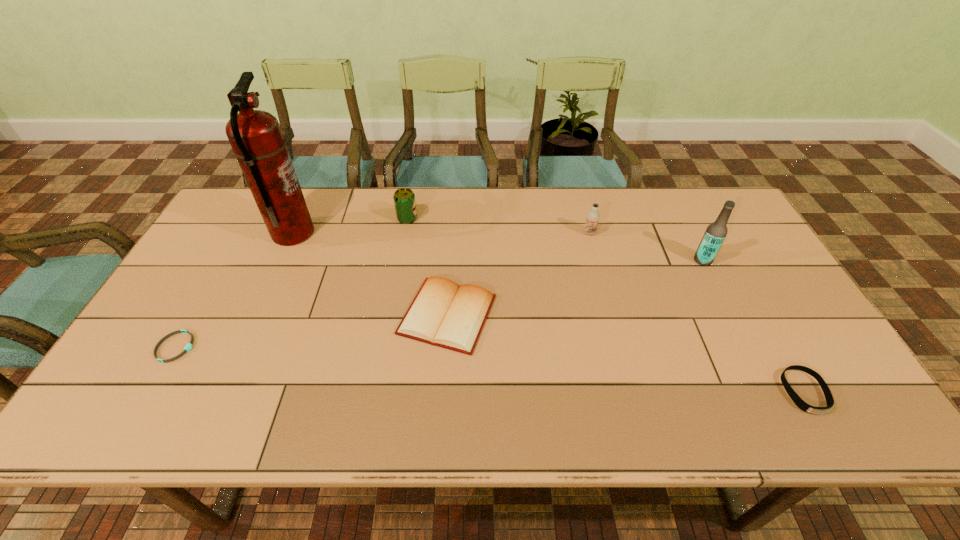
This screenshot has height=540, width=960. I want to click on the farther wristband, so click(x=188, y=347).

You are a GUI agent. You are given a task and a screenshot of the screen. Output one action in this format:
    pyautogui.click(x=<x>, y=<y>)
    Task: Click on the free space located on the side of the tallest object with the handle and hose
    This screenshot has width=960, height=540.
    Given the screenshot: What is the action you would take?
    pyautogui.click(x=372, y=233)

Identify the location of vacant area located 0.280m on the label of the second tallest object. The image size is (960, 540). (599, 260).

In order to click on vacant space located 0.330m on the label of the second tallest object in this screenshot , I will do `click(582, 260)`.

Where is `vacant region located on the label of the second tallest object`? vacant region located on the label of the second tallest object is located at coordinates (578, 260).

Image resolution: width=960 pixels, height=540 pixels. I want to click on vacant space situated 0.080m on the back of the fifth object from left to right, so click(x=585, y=213).

Where is `vacant space located on the left of the beer can`? vacant space located on the left of the beer can is located at coordinates (326, 219).

The image size is (960, 540). What are the coordinates of `vacant space located on the back of the third shortest object` in the screenshot? It's located at (451, 262).

Identify the location of vacant space located 0.140m on the buckle of the shortest object. The width and height of the screenshot is (960, 540). [x=251, y=347].

The image size is (960, 540). In order to click on fire extinguisher that is at the far edge in this screenshot , I will do `click(256, 138)`.